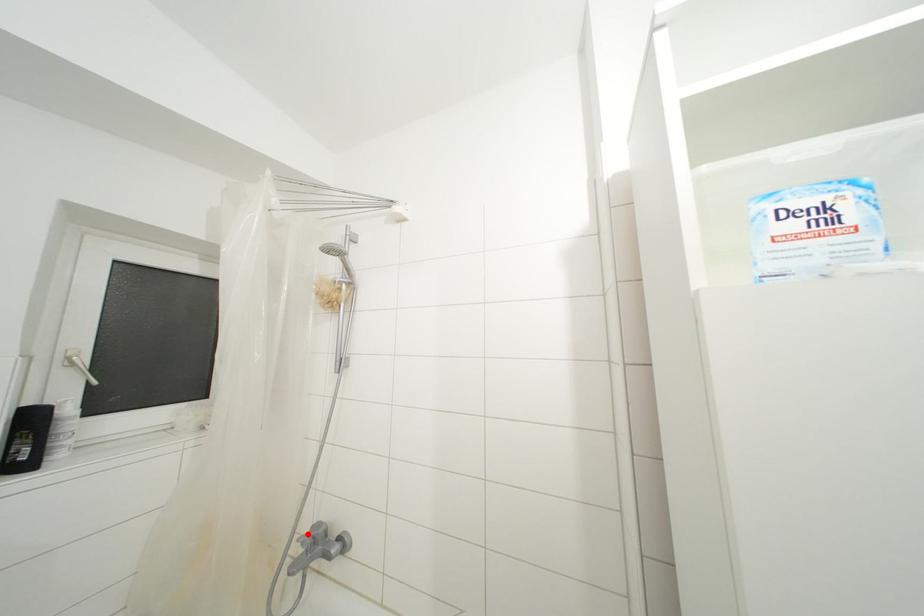
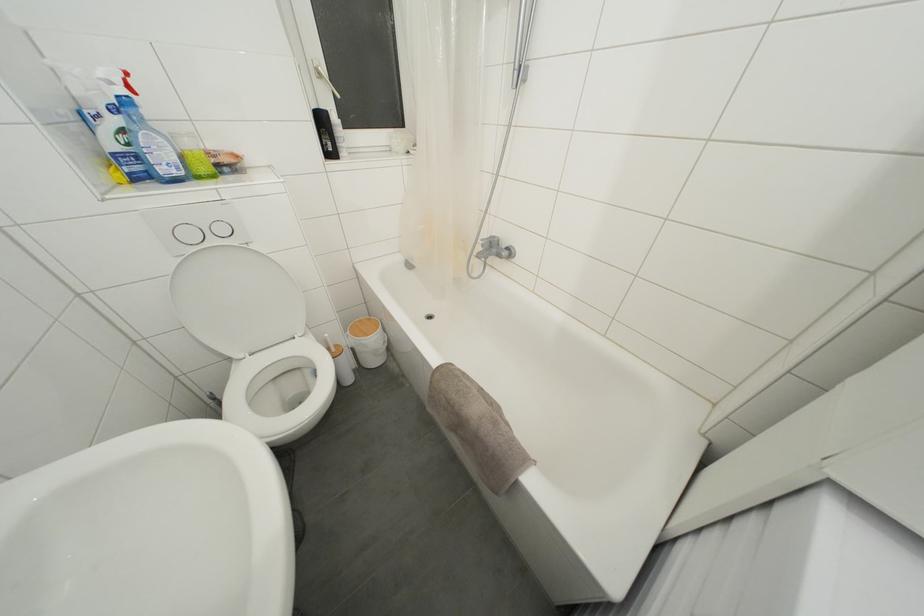
Locate, in the second image, the point that corresponds to the highlighted location in the first image.

(488, 240)